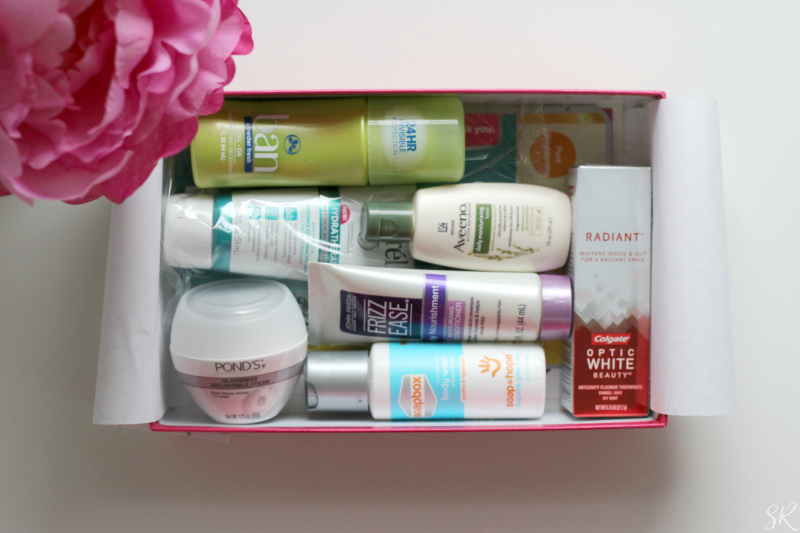
This screenshot has width=800, height=533. What are the coordinates of `table` in the screenshot? It's located at (290, 459), (553, 484), (722, 104), (550, 37), (38, 311).